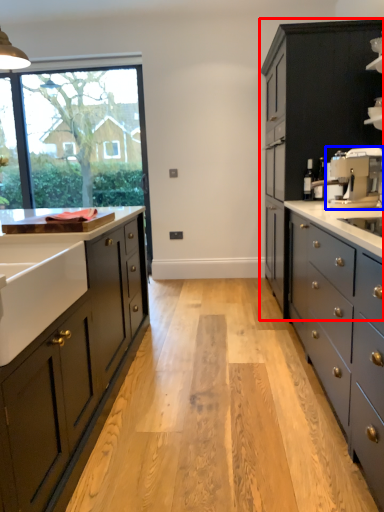
Question: Which object appears closest to the camera in this image, cabinetry (highlighted by a red box) or coffee machine (highlighted by a blue box)?

Choices:
 (A) cabinetry
 (B) coffee machine

Answer: (B)